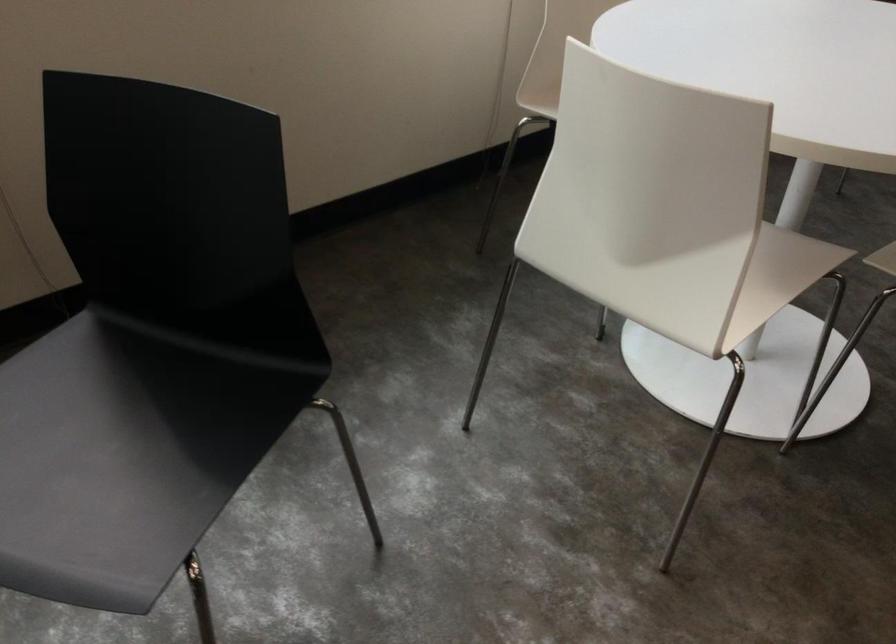
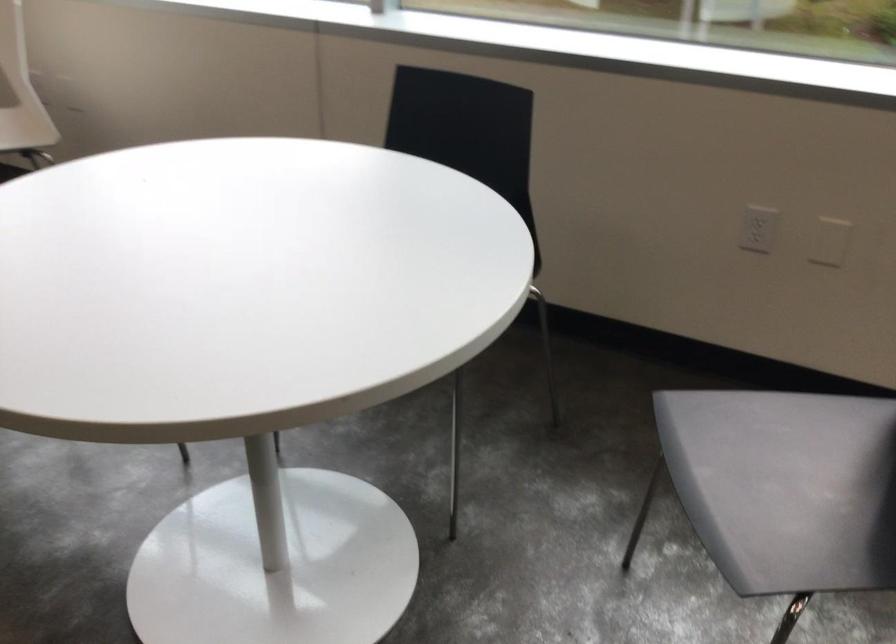
Question: Based on the continuous images, in which direction is the camera rotating? Reply with the corresponding letter.

Choices:
 (A) Left
 (B) Right
 (C) Up
 (D) Down

Answer: (A)